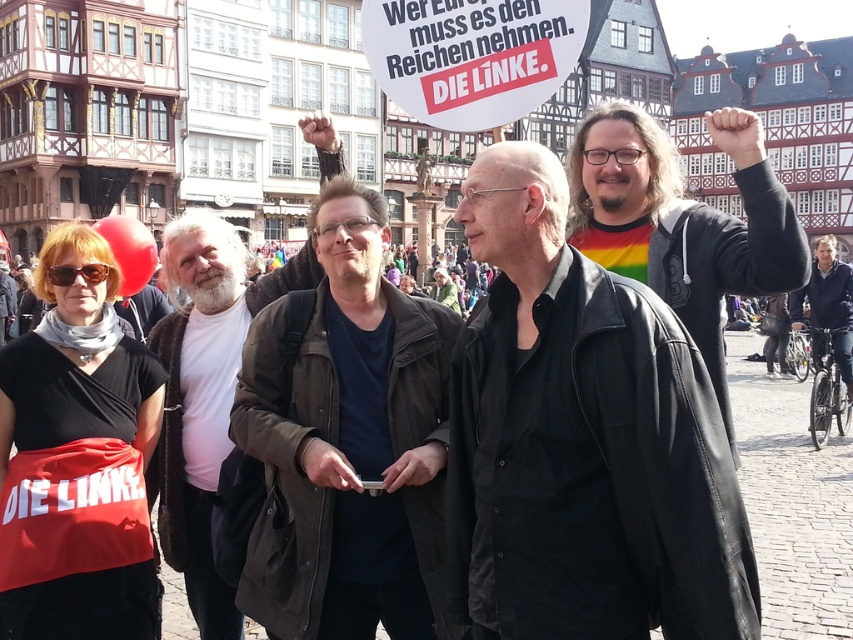
Question: Which object appears closest to the camera in this image?

Choices:
 (A) black leather jacket at center
 (B) dark brown leather jacket at center
 (C) white t-shirt at center
 (D) rainbow striped shirt at right

Answer: (A)

Question: Which point is closer to the camera taking this photo?

Choices:
 (A) [x=567, y=481]
 (B) [x=612, y=225]
 (C) [x=405, y=374]
 (D) [x=187, y=541]

Answer: (A)

Question: Which point appears farthest from the camera in this image?

Choices:
 (A) pyautogui.click(x=399, y=540)
 (B) pyautogui.click(x=178, y=346)

Answer: (B)

Question: Does dark brown leather jacket at center have a larger size compared to rainbow striped shirt at right?

Choices:
 (A) yes
 (B) no

Answer: (B)

Question: Considering the relative positions of dark brown leather jacket at center and white t-shirt at center in the image provided, where is dark brown leather jacket at center located with respect to white t-shirt at center?

Choices:
 (A) above
 (B) below

Answer: (B)

Question: Can you confirm if dark brown leather jacket at center is positioned to the right of white t-shirt at center?

Choices:
 (A) no
 (B) yes

Answer: (B)